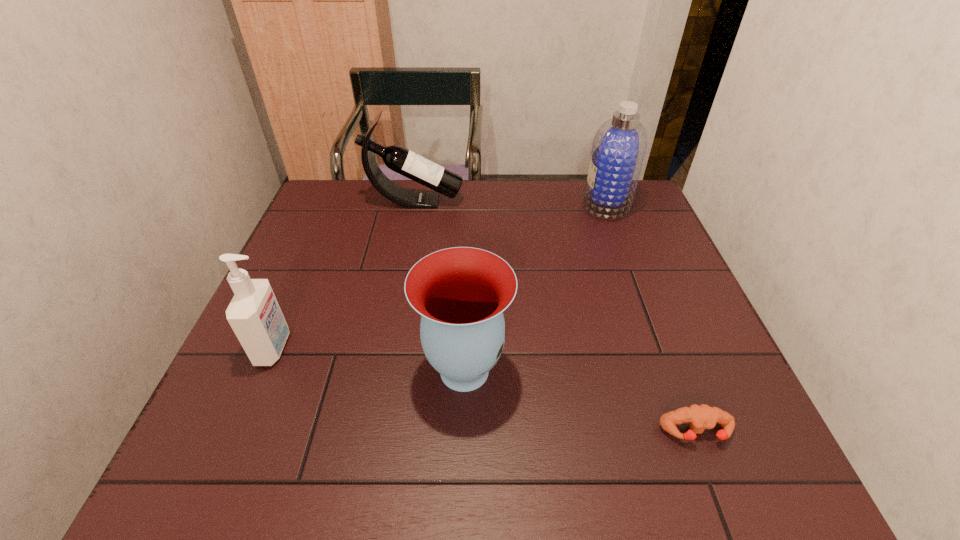
This screenshot has height=540, width=960. I want to click on empty space between the wine bottle and the nearest object, so click(556, 317).

At what (x,y) coordinates should I click in order to perform the action: click on free space between the vase and the taller cleansing agent. Please return your answer as a coordinate pair (x, y). The image size is (960, 540). Looking at the image, I should click on (536, 287).

The image size is (960, 540). I want to click on vacant area between the puncher and the wine bottle, so click(556, 317).

This screenshot has height=540, width=960. Identify the location of object that stands as the third closest to the vase. (618, 150).

Locate which object is the second closest to the vase. Please provide its 2D coordinates. Your answer should be formatted as a tuple, i.e. [(x, y)], where the tuple contains the x and y coordinates of a point satisfying the conditions above.

[(254, 314)]

Image resolution: width=960 pixels, height=540 pixels. I want to click on vacant space that satisfies the following two spatial constraints: 1. on the stand of the wine bottle; 2. on the back side of the taller cleansing agent, so click(415, 203).

I want to click on vacant region that satisfies the following two spatial constraints: 1. on the back side of the vase; 2. on the right side of the taller cleansing agent, so click(469, 203).